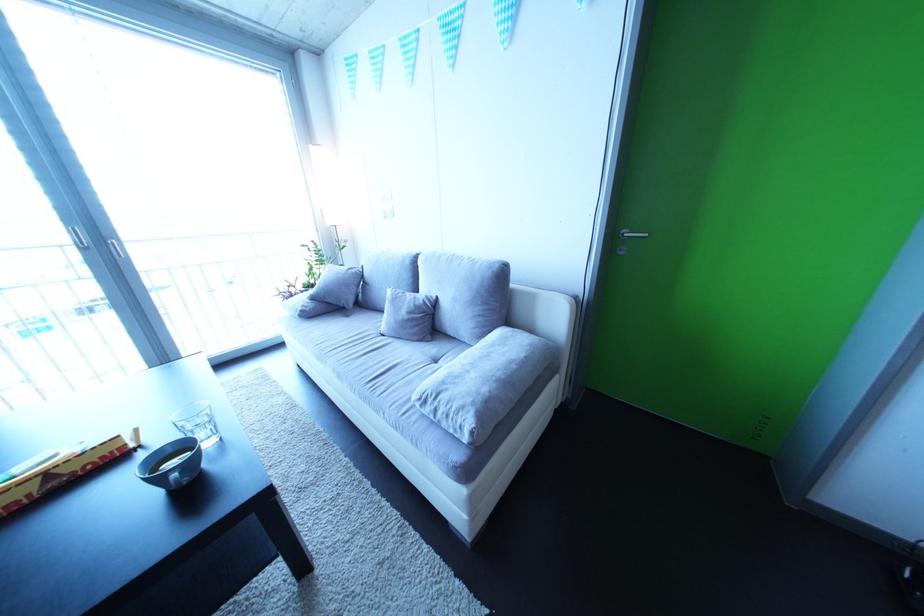
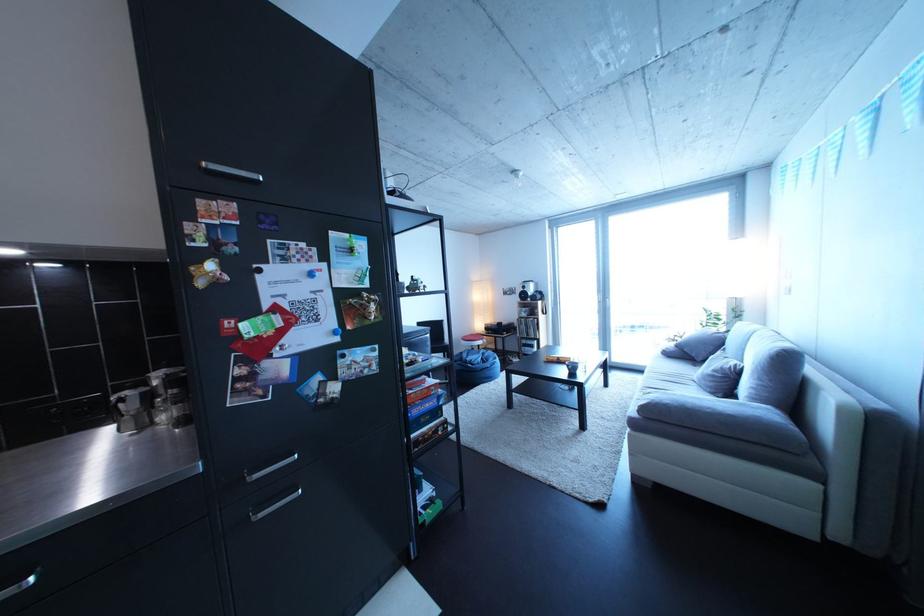
In the second image, find the point that corresponds to the point at 322,322 in the first image.

(682, 361)